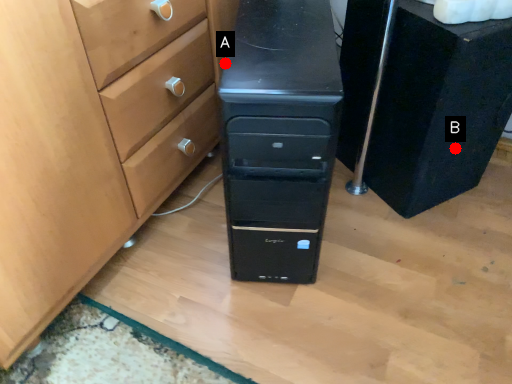
Question: Two points are circled on the image, labeled by A and B beside each circle. Which point is closer to the camera taking this photo?

Choices:
 (A) A is closer
 (B) B is closer

Answer: (A)